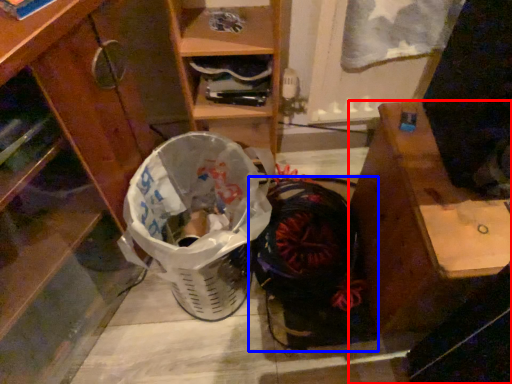
Question: Among these objects, which one is nearest to the camera, desk (highlighted by a red box) or footwear (highlighted by a blue box)?

Choices:
 (A) desk
 (B) footwear

Answer: (A)